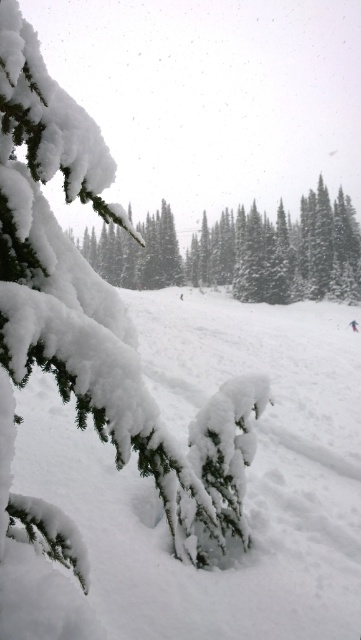
Between white snow ski slope at center and snow-covered pine branch at center, which one appears on the left side from the viewer's perspective?

snow-covered pine branch at center

Where is `white snow ski slope at center`? The image size is (361, 640). white snow ski slope at center is located at coordinates (246, 474).

At what (x,y) coordinates should I click in order to perform the action: click on white snow ski slope at center. Please return your answer as a coordinate pair (x, y). The width and height of the screenshot is (361, 640). Looking at the image, I should click on (246, 474).

Where is `white snow ski slope at center`? white snow ski slope at center is located at coordinates (246, 474).

Which is more to the right, white snow ski slope at center or white matte snowboarder at center?

white matte snowboarder at center

Does white snow ski slope at center appear on the left side of white matte snowboarder at center?

Indeed, white snow ski slope at center is positioned on the left side of white matte snowboarder at center.

Which is behind, point (98, 580) or point (354, 323)?

Point (354, 323)

This screenshot has width=361, height=640. I want to click on white snow ski slope at center, so click(246, 474).

Locate an element on the screen. The height and width of the screenshot is (640, 361). snow-covered pine branch at center is located at coordinates (242, 252).

You are a GUI agent. You are given a task and a screenshot of the screen. Output one action in this format:
    pyautogui.click(x=<x>, y=<y>)
    Task: Click on the snow-covered pine branch at center
    Image resolution: width=361 pixels, height=640 pixels.
    Given the screenshot: What is the action you would take?
    pyautogui.click(x=242, y=252)